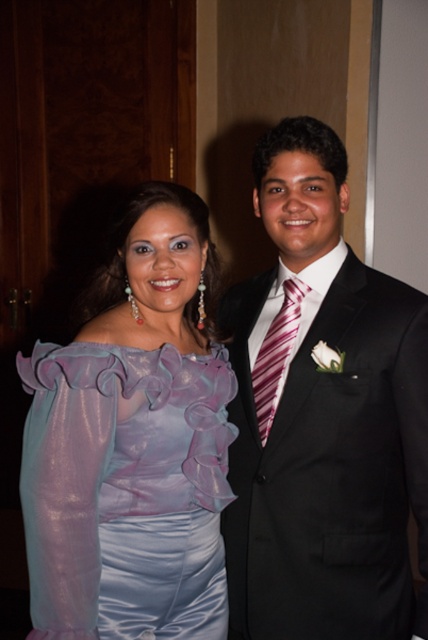
Question: Considering the relative positions of translucent purple blouse at upper left and striped silk tie at center in the image provided, where is translucent purple blouse at upper left located with respect to striped silk tie at center?

Choices:
 (A) left
 (B) right

Answer: (A)

Question: Can you confirm if shiny black suit at center is thinner than striped silk tie at center?

Choices:
 (A) no
 (B) yes

Answer: (A)

Question: Is translucent purple blouse at upper left closer to camera compared to striped silk tie at center?

Choices:
 (A) no
 (B) yes

Answer: (B)

Question: Which object is closer to the camera taking this photo?

Choices:
 (A) translucent purple blouse at upper left
 (B) shiny black suit at center

Answer: (A)

Question: Which object is farther from the camera taking this photo?

Choices:
 (A) shiny black suit at center
 (B) translucent purple blouse at upper left

Answer: (A)

Question: Among these points, which one is farthest from the camera?

Choices:
 (A) (362, 552)
 (B) (279, 348)
 (C) (83, 499)

Answer: (B)